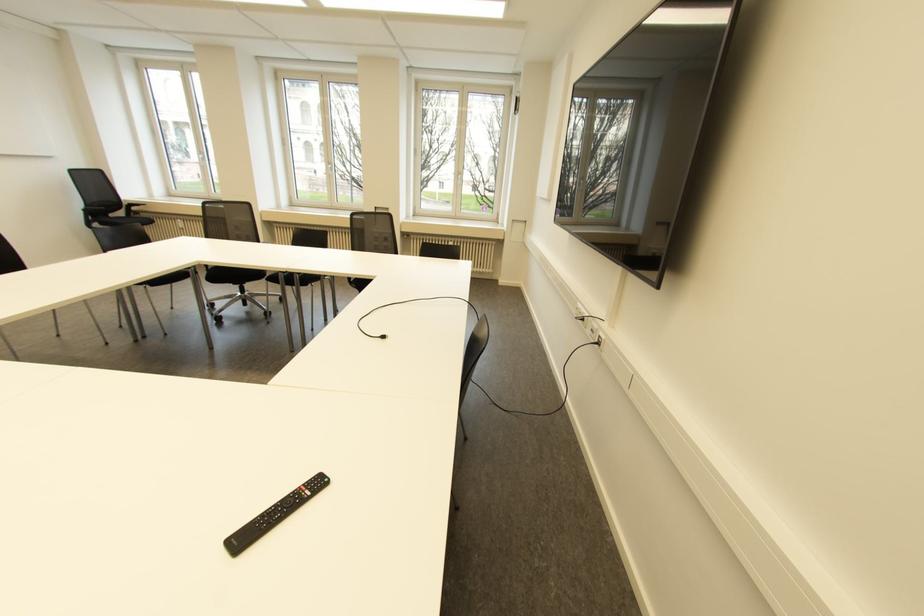
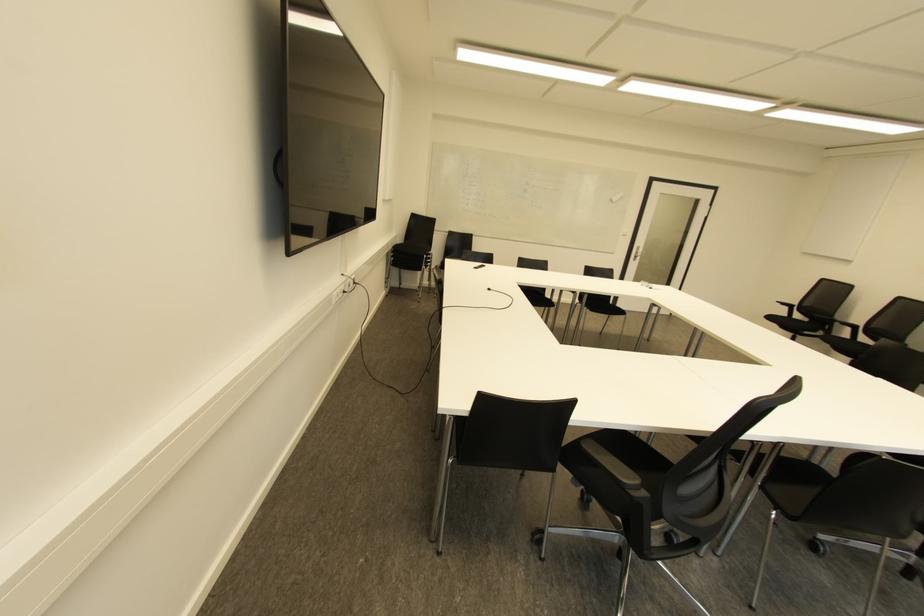
Where in the second image is the point corresponding to the point at 598,342 from the first image?

(354, 282)